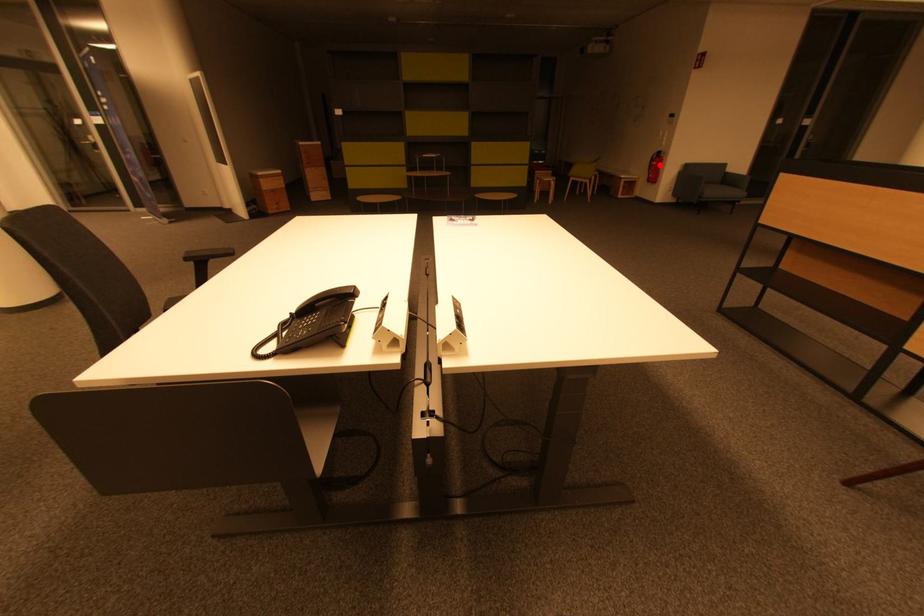
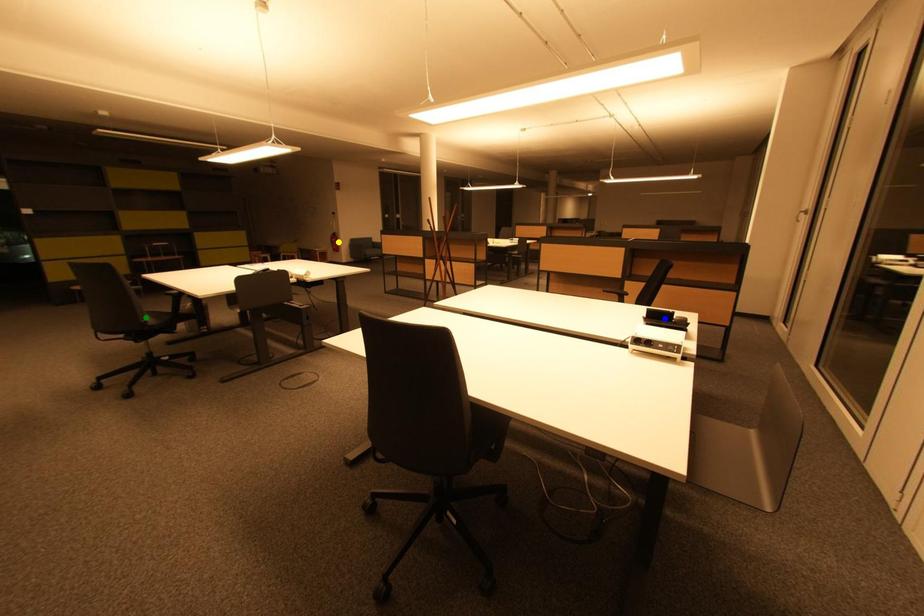
Question: I am providing you with two images of the same scene from different viewpoints. A red point is marked on the first image. You are given multiple points on the second image. Can you choose the point in image 2 that corresponds to the point in image 1?

Choices:
 (A) yellow point
 (B) blue point
 (C) green point

Answer: (A)